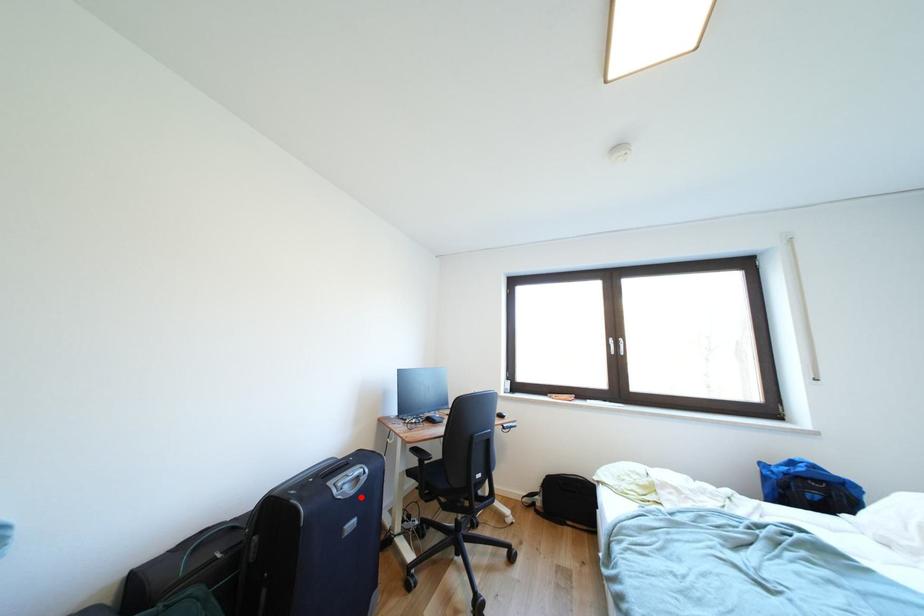
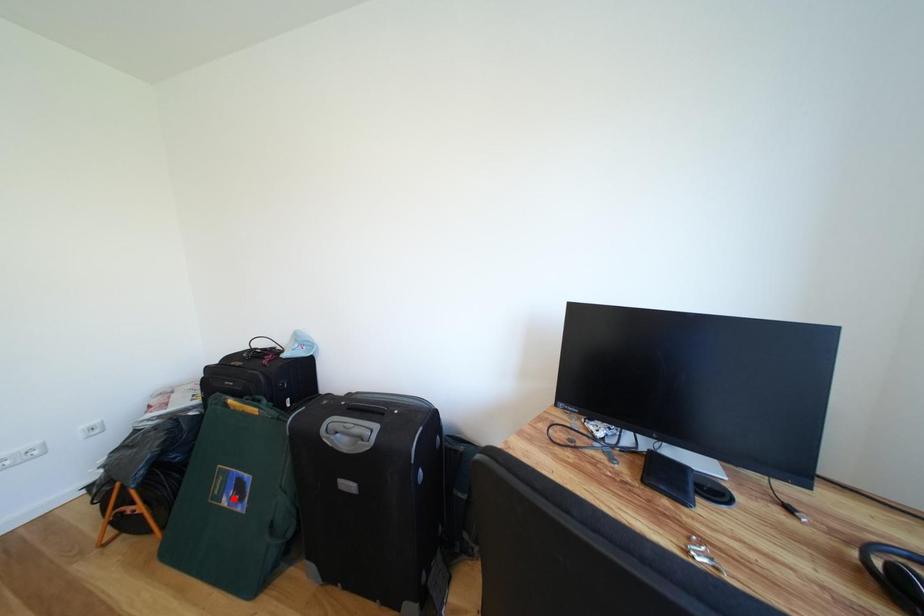
I am providing you with two images of the same scene from different viewpoints. A red point is marked on the first image and another point is marked on the second image. Does the point marked in image1 correspond to the same location as the one in image2?

No